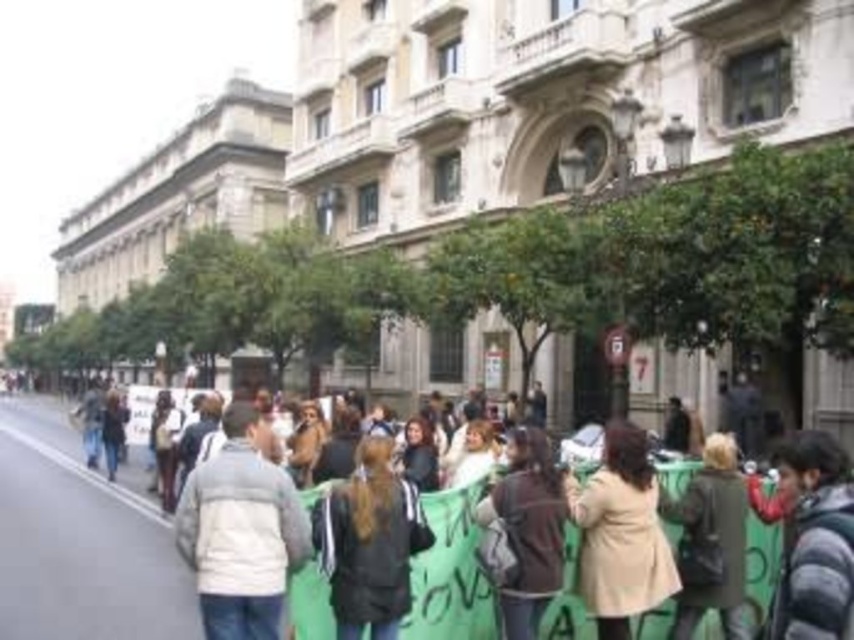
Question: Among these objects, which one is nearest to the camera?

Choices:
 (A) light gray fleece jacket at center
 (B) dark gray jacket at center
 (C) green fabric banner at center
 (D) gray asphalt at lower left

Answer: (A)

Question: Does gray asphalt at lower left have a greater width compared to dark gray jacket at center?

Choices:
 (A) yes
 (B) no

Answer: (A)

Question: Is green fabric banner at center to the right of light gray fleece jacket at center from the viewer's perspective?

Choices:
 (A) no
 (B) yes

Answer: (B)

Question: Which is nearer to the gray asphalt at lower left?

Choices:
 (A) light gray fleece jacket at center
 (B) dark gray jacket at center
 (C) green fabric banner at center

Answer: (A)

Question: Does green fabric banner at center lie behind light gray fleece jacket at center?

Choices:
 (A) yes
 (B) no

Answer: (A)

Question: Which point appears closest to the camera in this image?

Choices:
 (A) (250, 436)
 (B) (38, 612)

Answer: (A)